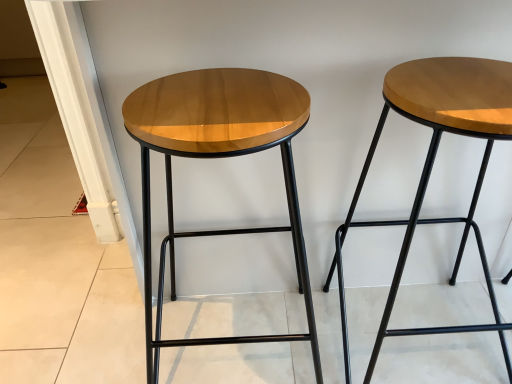
Identify the location of free space above glossy wood stool at left, the 1th stool positioned from the left (from a real-world perspective). (213, 97).